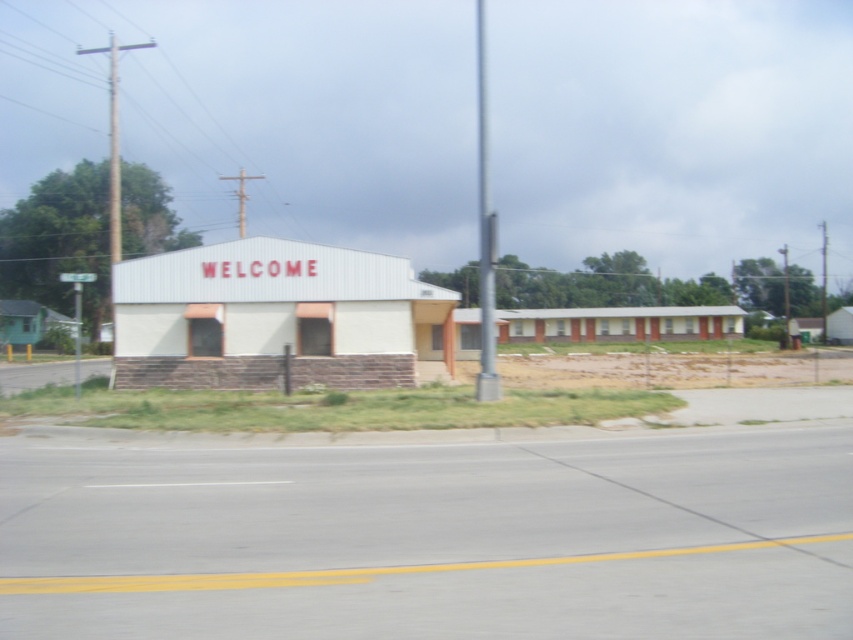
You are a delivery driver approaching the white matte building at center and the metallic gray pole at center. The road has a yellow dividing line. Can you estimate which one is wider from your perspective?

The white matte building at center is wider than the metallic gray pole at center, so the building appears wider from your perspective.

You are driving down the road and see the white matte building at center and the metallic gray pole at center. Which one is positioned lower in the image?

The white matte building at center is located below the metallic gray pole at center, so the white matte building at center is positioned lower in the image.